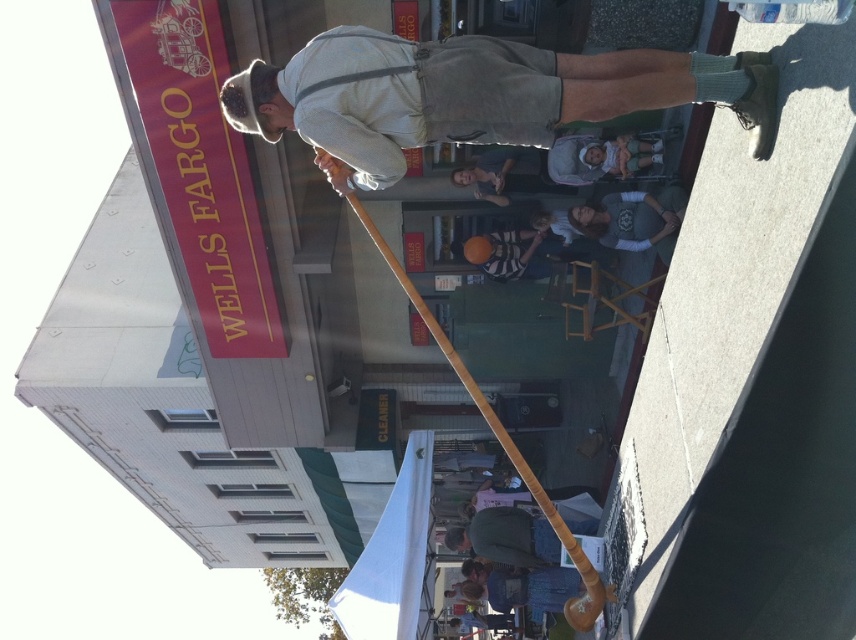
Can you confirm if wooden pole at center is shorter than gray cotton shirt at center?

Yes.

How far apart are wooden pole at center and gray cotton shirt at center?

wooden pole at center is 6.62 meters away from gray cotton shirt at center.

Where is `wooden pole at center`? wooden pole at center is located at coordinates (503, 445).

You are a GUI agent. You are given a task and a screenshot of the screen. Output one action in this format:
    pyautogui.click(x=<x>, y=<y>)
    Task: Click on the light brown wooden cane at center
    Image resolution: width=856 pixels, height=640 pixels.
    Given the screenshot: What is the action you would take?
    pyautogui.click(x=473, y=96)

Between point (354, 68) and point (646, 196), which one is positioned in front?

Point (354, 68) is in front.

Where is `light brown wooden cane at center`? Image resolution: width=856 pixels, height=640 pixels. light brown wooden cane at center is located at coordinates (473, 96).

Does wooden pole at center have a greater height compared to striped cotton shirt at center?

In fact, wooden pole at center may be shorter than striped cotton shirt at center.

Does wooden pole at center appear on the right side of striped cotton shirt at center?

Correct, you'll find wooden pole at center to the right of striped cotton shirt at center.

Which is behind, point (572, 627) or point (512, 241)?

The point (512, 241) is more distant.

Locate an element on the screen. This screenshot has width=856, height=640. wooden pole at center is located at coordinates (503, 445).